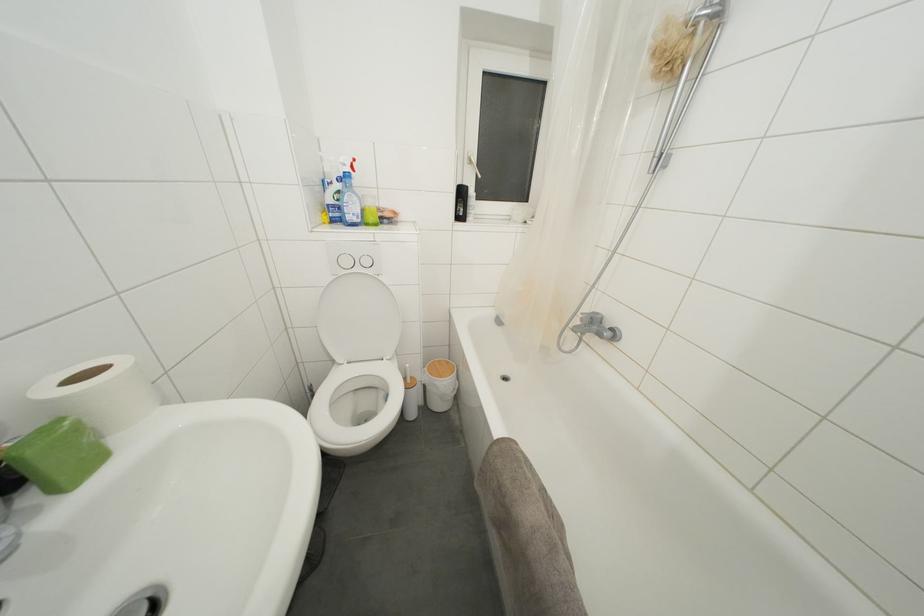
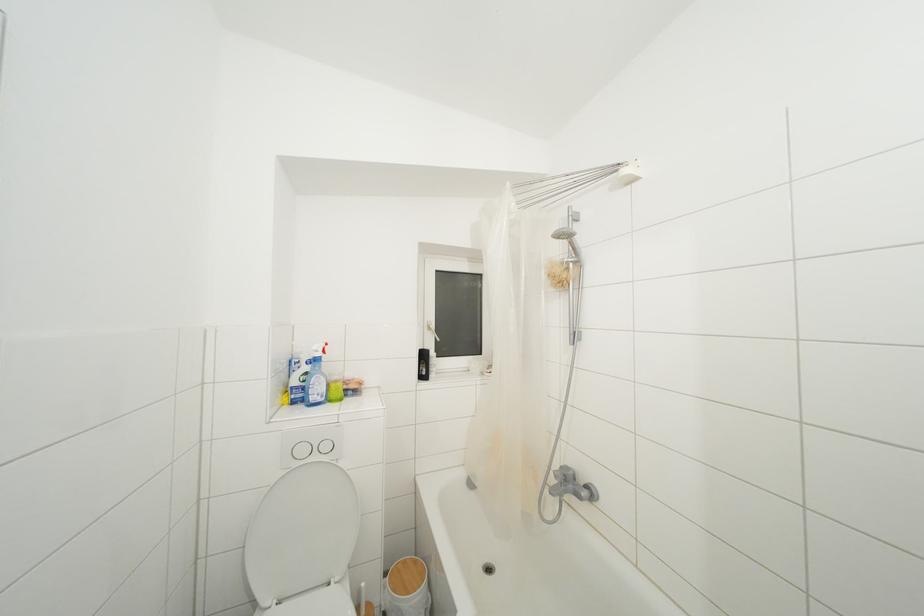
Where in the second image is the point corresponding to (361,274) from the first image?

(320, 463)